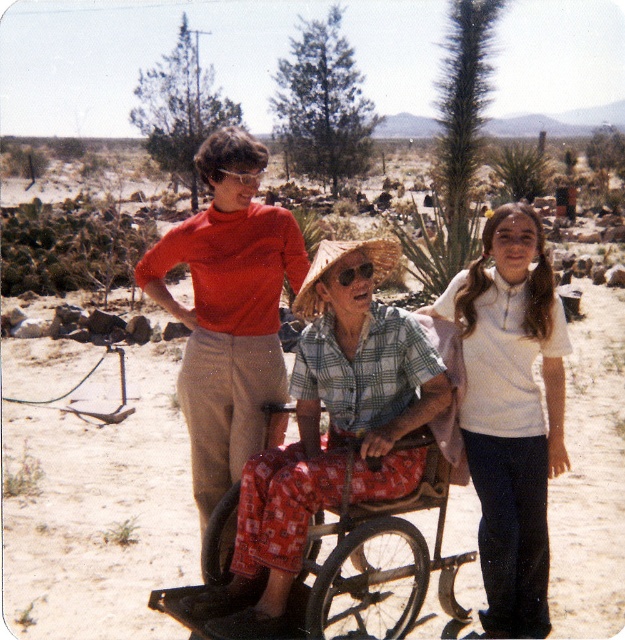
What object is located at the coordinates point (336, 260) in the image?

The point (336, 260) corresponds to the strawmaterial texture hat at center.

You are standing in the desert scene and want to walk from point A to point B. Point A is at coordinate point (488,570) and point B is at coordinate point (395,256). Which point should you start at if you want to walk towards the camera?

You should start at point B at coordinate point (395,256) because it is closer to the camera than point A at coordinate point (488,570).

You are a photographer trying to capture a group photo of the plaid cotton shirt at center and the plaid fabric wheelchair at center. You want to ensure both subjects are fully visible in the frame. Based on their sizes, which subject might require more space in the width direction?

The plaid cotton shirt at center might be wider than the plaid fabric wheelchair at center, so it might require more space in the width direction.